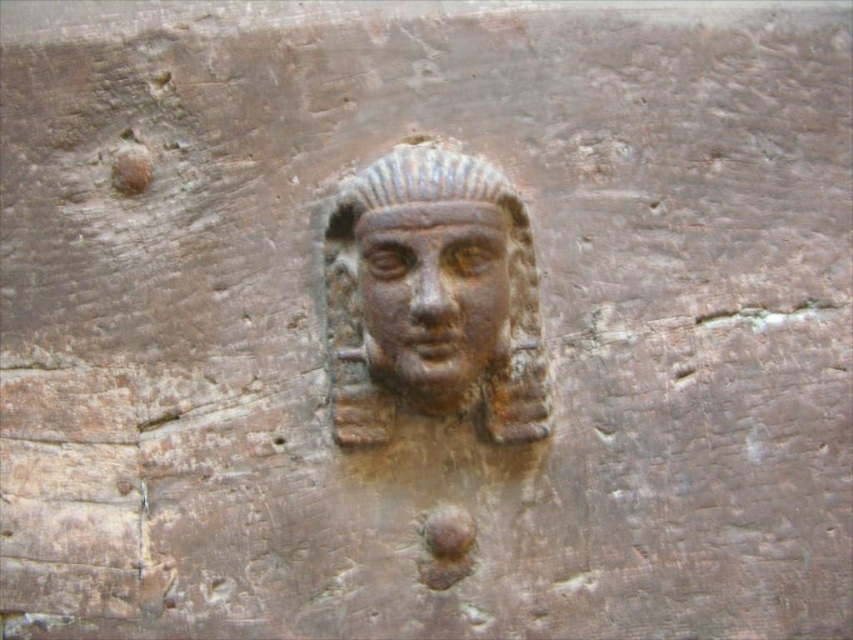
Question: Which point is closer to the camera?

Choices:
 (A) rusty stone head at center
 (B) rusty bronze face at center

Answer: (A)

Question: Is the position of rusty stone head at center less distant than that of rusty bronze face at center?

Choices:
 (A) yes
 (B) no

Answer: (A)

Question: Is rusty stone head at center above rusty bronze face at center?

Choices:
 (A) yes
 (B) no

Answer: (B)

Question: Among these points, which one is farthest from the camera?

Choices:
 (A) (480, 224)
 (B) (451, 218)

Answer: (A)

Question: Does rusty stone head at center have a smaller size compared to rusty bronze face at center?

Choices:
 (A) yes
 (B) no

Answer: (B)